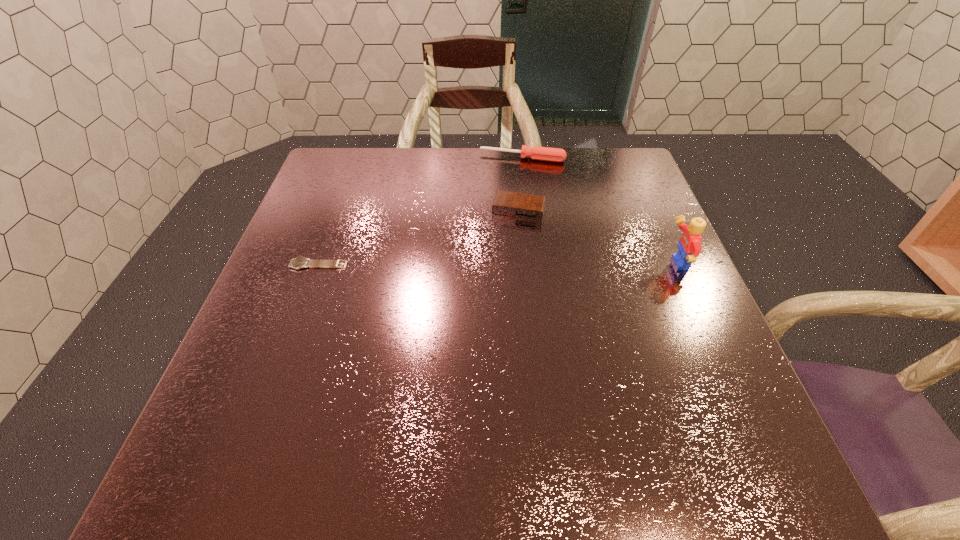
Locate an element on the screen. The width and height of the screenshot is (960, 540). the leftmost object is located at coordinates (300, 262).

The height and width of the screenshot is (540, 960). What are the coordinates of `the shortest object` in the screenshot? It's located at (300, 262).

This screenshot has width=960, height=540. I want to click on Lego, so click(x=689, y=247).

This screenshot has width=960, height=540. In order to click on the rightmost object in this screenshot , I will do `click(689, 247)`.

The width and height of the screenshot is (960, 540). Find the location of `the farthest object`. the farthest object is located at coordinates [535, 153].

You are a GUI agent. You are given a task and a screenshot of the screen. Output one action in this format:
    pyautogui.click(x=<x>, y=<y>)
    Task: Click on the alarm clock
    
    Given the screenshot: What is the action you would take?
    pyautogui.click(x=508, y=204)

The image size is (960, 540). What are the coordinates of `free space located 0.150m on the back of the watch` in the screenshot? It's located at (336, 218).

Locate an element on the screen. This screenshot has width=960, height=540. vacant position located on the face of the Lego is located at coordinates (584, 264).

The image size is (960, 540). What are the coordinates of `vacant space positioned 0.200m on the face of the Lego` in the screenshot? It's located at (575, 264).

Image resolution: width=960 pixels, height=540 pixels. In order to click on blank space located 0.070m on the face of the Lego in this screenshot , I will do `click(633, 264)`.